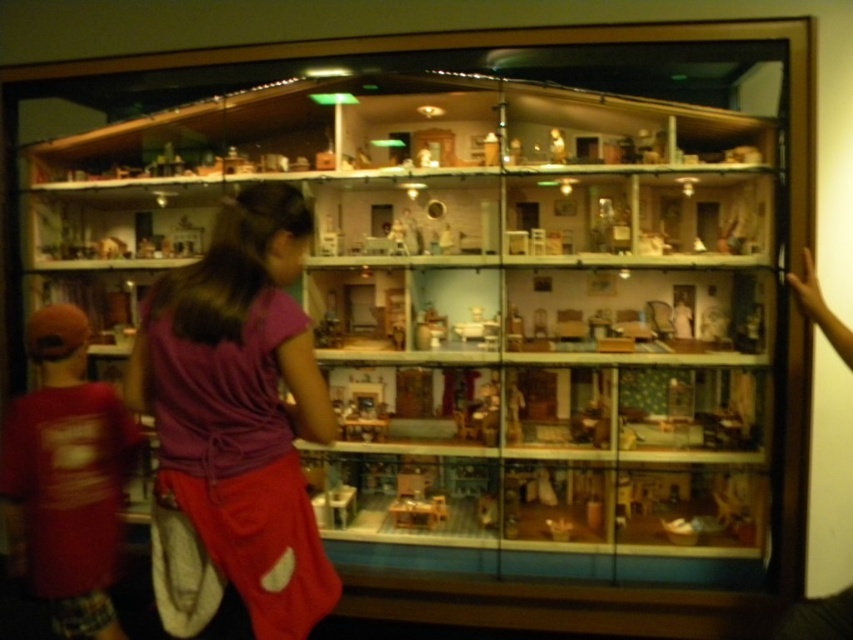
You are a visitor observing the dollhouse display. You notice the purple fabric skirt at center and the matte red shirt at left. Which object is closer to you in the display?

The purple fabric skirt at center is closer to you because it is in front of the matte red shirt at left.